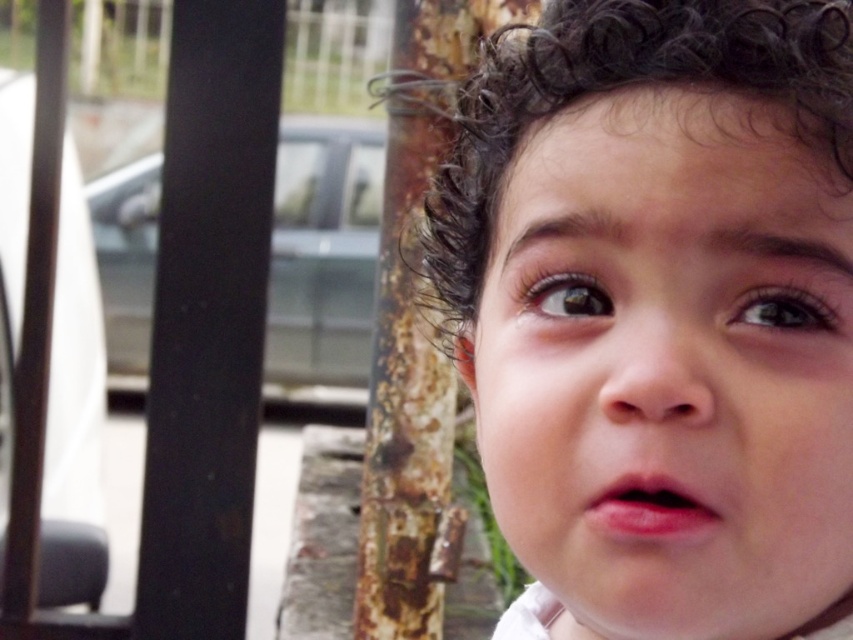
From the picture: Which of these two, dark curly hair at center or brown glossy eye at upper center, stands shorter?

brown glossy eye at upper center is shorter.

Is dark curly hair at center smaller than brown glossy eye at upper center?

Incorrect, dark curly hair at center is not smaller in size than brown glossy eye at upper center.

Who is more distant from viewer, (759,80) or (595,316)?

Point (595,316)

What are the coordinates of `dark curly hair at center` in the screenshot? It's located at (611, 92).

Can you confirm if dark curly hair at center is shorter than brown glossy eye at upper right?

No.

This screenshot has width=853, height=640. Describe the element at coordinates (611, 92) in the screenshot. I see `dark curly hair at center` at that location.

Is point (616, 49) less distant than point (782, 310)?

No.

This screenshot has width=853, height=640. Find the location of `dark curly hair at center`. dark curly hair at center is located at coordinates (611, 92).

Between brown glossy eye at upper right and brown glossy eye at upper center, which one has more height?

Standing taller between the two is brown glossy eye at upper right.

Does brown glossy eye at upper right have a lesser height compared to brown glossy eye at upper center?

In fact, brown glossy eye at upper right may be taller than brown glossy eye at upper center.

Describe the element at coordinates (782, 308) in the screenshot. I see `brown glossy eye at upper right` at that location.

Where is `brown glossy eye at upper right`? brown glossy eye at upper right is located at coordinates (782, 308).